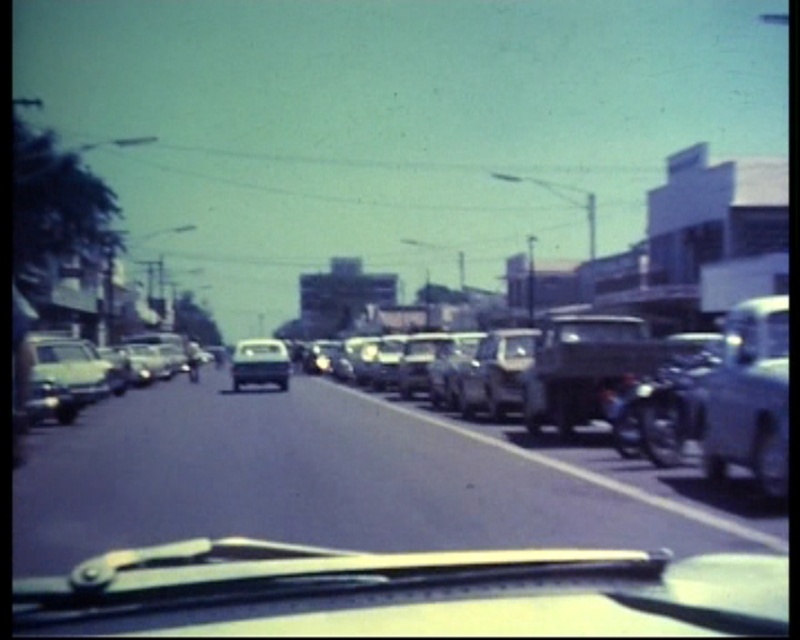
Question: Is metallic silver car at center bigger than shiny silver sedan at center?

Choices:
 (A) no
 (B) yes

Answer: (A)

Question: Which point is closer to the camera?

Choices:
 (A) (494, 404)
 (B) (252, 353)
 (C) (782, 451)

Answer: (C)

Question: Does metallic silver truck at right appear under shiny silver sedan at center?

Choices:
 (A) no
 (B) yes

Answer: (A)

Question: Estimate the real-world distances between objects in this image. Which object is closer to the metallic silver car at center?

Choices:
 (A) shiny silver sedan at center
 (B) metallic silver truck at right

Answer: (B)

Question: Can you confirm if metallic silver car at center is bigger than shiny silver sedan at center?

Choices:
 (A) yes
 (B) no

Answer: (B)

Question: Which object is closer to the camera taking this photo?

Choices:
 (A) shiny silver sedan at center
 (B) metallic silver car at center

Answer: (B)